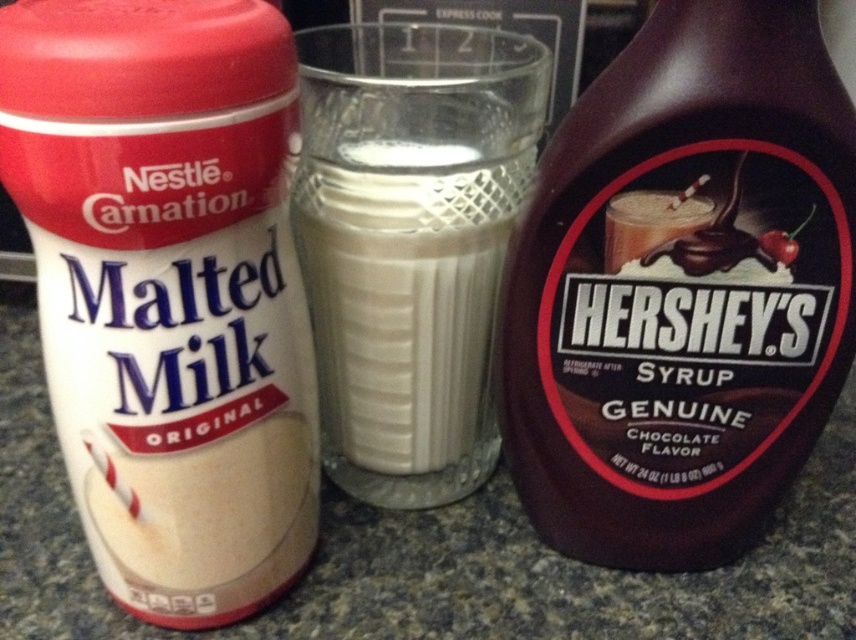
Is white matte malted milk powder at left positioned in front of dark brown syrup at right?

Yes, white matte malted milk powder at left is in front of dark brown syrup at right.

Locate an element on the screen. The width and height of the screenshot is (856, 640). white matte malted milk powder at left is located at coordinates (168, 289).

Is dark brown syrup at right to the left of white opaque glass at center from the viewer's perspective?

Incorrect, dark brown syrup at right is not on the left side of white opaque glass at center.

Who is positioned more to the right, dark brown syrup at right or white opaque glass at center?

Positioned to the right is dark brown syrup at right.

Does point (675, 54) come closer to viewer compared to point (361, 403)?

Yes, it is in front of point (361, 403).

Find the location of `dark brown syrup at right`. dark brown syrup at right is located at coordinates (681, 289).

Can you confirm if white matte malted milk powder at left is positioned to the left of white opaque glass at center?

Correct, you'll find white matte malted milk powder at left to the left of white opaque glass at center.

Identify the location of white matte malted milk powder at left. The image size is (856, 640). (168, 289).

The width and height of the screenshot is (856, 640). I want to click on white matte malted milk powder at left, so click(x=168, y=289).